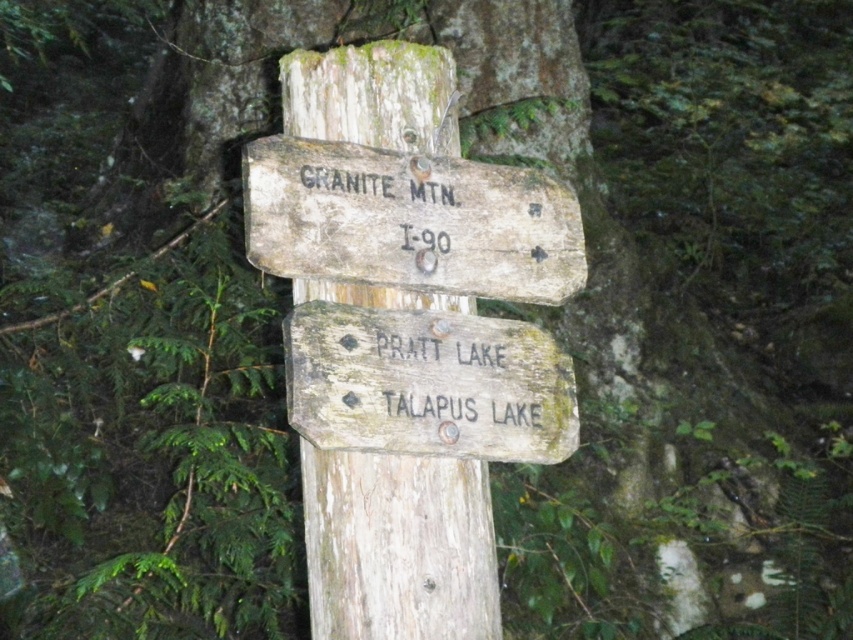
Question: Can you confirm if weathered wood signpost at center is thinner than weathered wood sign at center?

Choices:
 (A) no
 (B) yes

Answer: (B)

Question: Is weathered wood signpost at center further to the viewer compared to weathered wood sign at center?

Choices:
 (A) no
 (B) yes

Answer: (B)

Question: Which point is closer to the camera taking this photo?

Choices:
 (A) (433, 118)
 (B) (450, 212)
 (C) (453, 412)

Answer: (C)

Question: Which object appears farthest from the camera in this image?

Choices:
 (A) weathered wood signpost at upper center
 (B) weathered wood sign at center

Answer: (A)

Question: Estimate the real-world distances between objects in this image. Which object is closer to the weathered wood sign at center?

Choices:
 (A) weathered wood signpost at upper center
 (B) weathered wood signpost at center

Answer: (B)

Question: Where is weathered wood signpost at center located in relation to weathered wood sign at center in the image?

Choices:
 (A) above
 (B) below

Answer: (B)